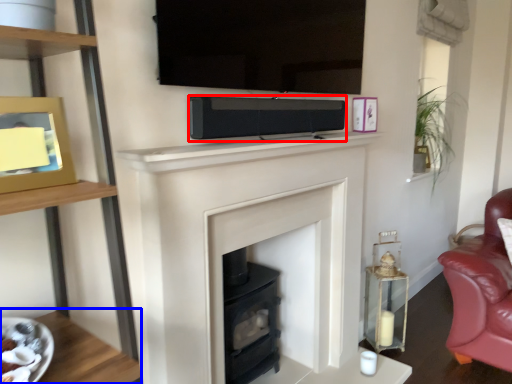
Question: Which of the following is the farthest to the observer, stereo (highlighted by a red box) or table (highlighted by a blue box)?

Choices:
 (A) stereo
 (B) table

Answer: (A)